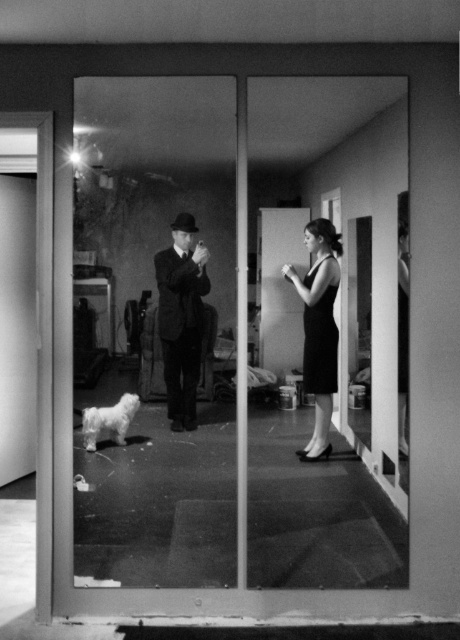
Who is more distant from viewer, (329, 294) or (104, 416)?

The point (104, 416) is behind.

Does black satin dress at center appear under white fluffy dog at lower left?

Actually, black satin dress at center is above white fluffy dog at lower left.

Which is in front, point (315, 451) or point (84, 413)?

Positioned in front is point (84, 413).

Find the location of `black satin dress at center`. black satin dress at center is located at coordinates (318, 328).

Who is more distant from viewer, (172, 266) or (107, 412)?

Positioned behind is point (107, 412).

Does smooth black suit at center have a lesser height compared to white fluffy dog at lower left?

Incorrect, smooth black suit at center's height does not fall short of white fluffy dog at lower left's.

Is point (190, 266) less distant than point (86, 412)?

Yes, it is.

Locate an element on the screen. This screenshot has height=640, width=460. smooth black suit at center is located at coordinates (182, 317).

Is the position of smooth black suit at center more distant than that of black satin dress at center?

No, smooth black suit at center is closer to the viewer.

Does smooth black suit at center appear on the left side of black satin dress at center?

Correct, you'll find smooth black suit at center to the left of black satin dress at center.

Identify the location of smooth black suit at center. (182, 317).

Identify the location of smooth black suit at center. (182, 317).